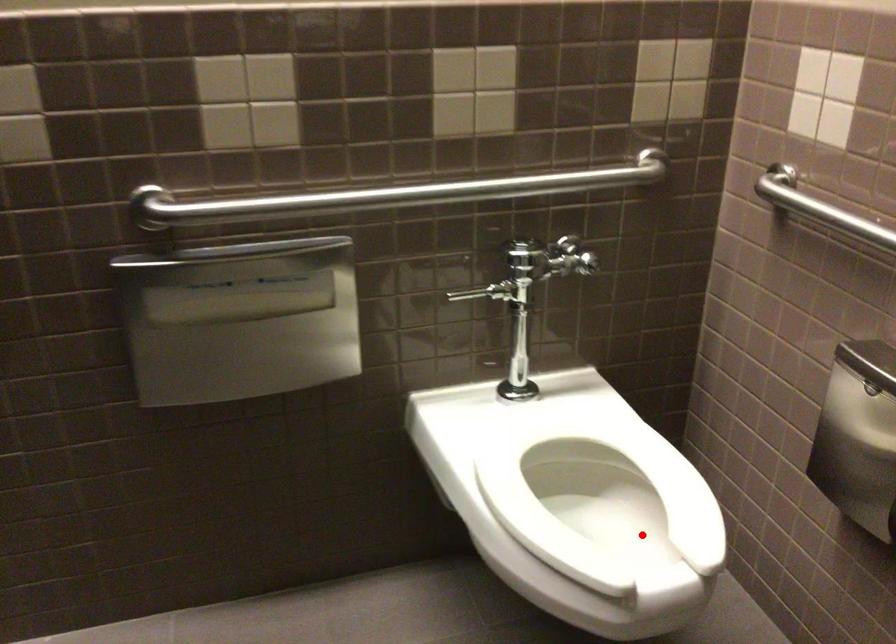
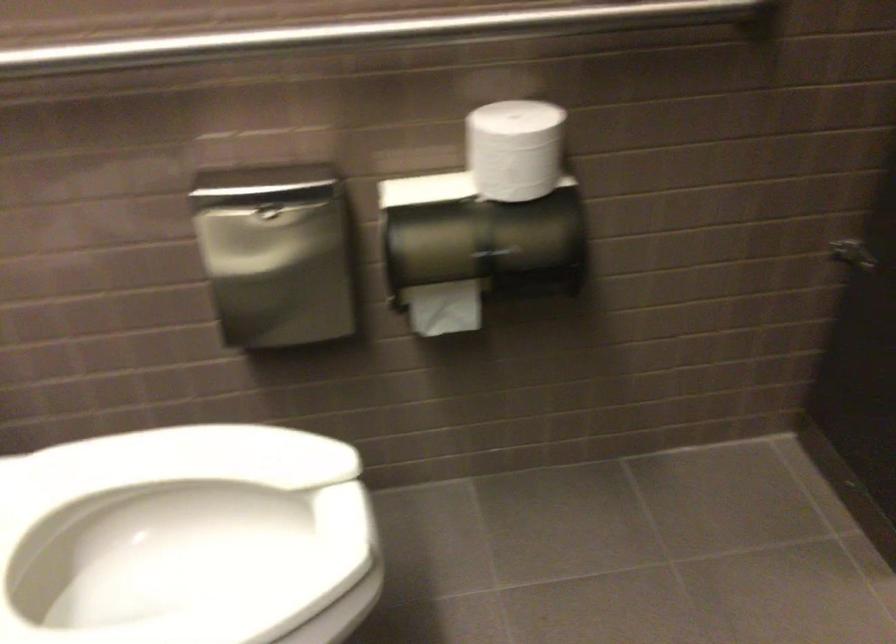
Find the pixel in the second image that matches the highlighted location in the first image.

(186, 538)